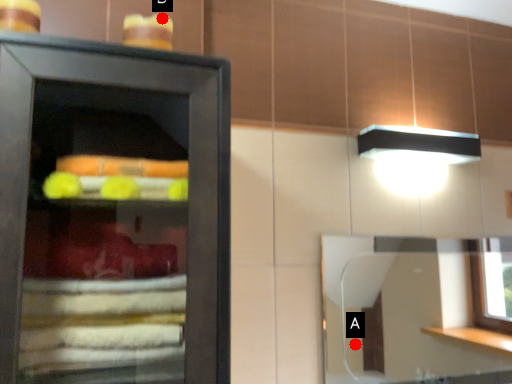
Question: Two points are circled on the image, labeled by A and B beside each circle. Which point is closer to the camera?

Choices:
 (A) A is closer
 (B) B is closer

Answer: (B)